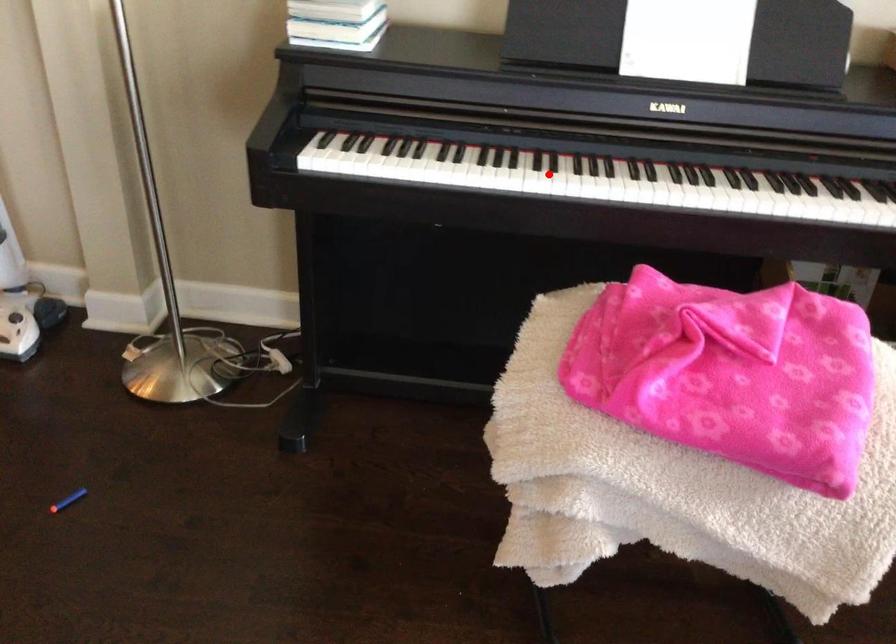
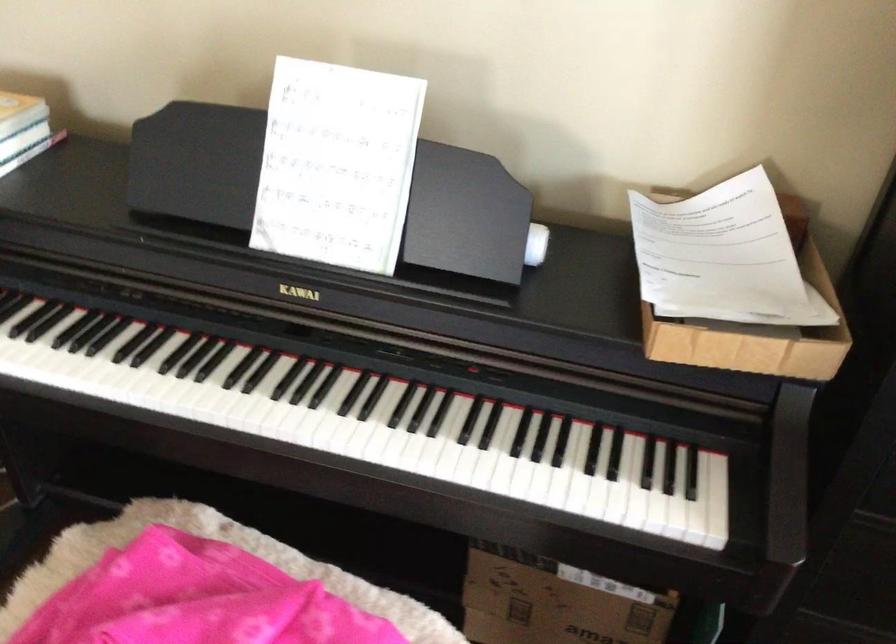
Question: I am providing you with two images of the same scene from different viewpoints. Given a red point in image1, look at the same physical point in image2. Is it:

Choices:
 (A) Closer to the viewpoint
 (B) Farther from the viewpoint

Answer: (A)